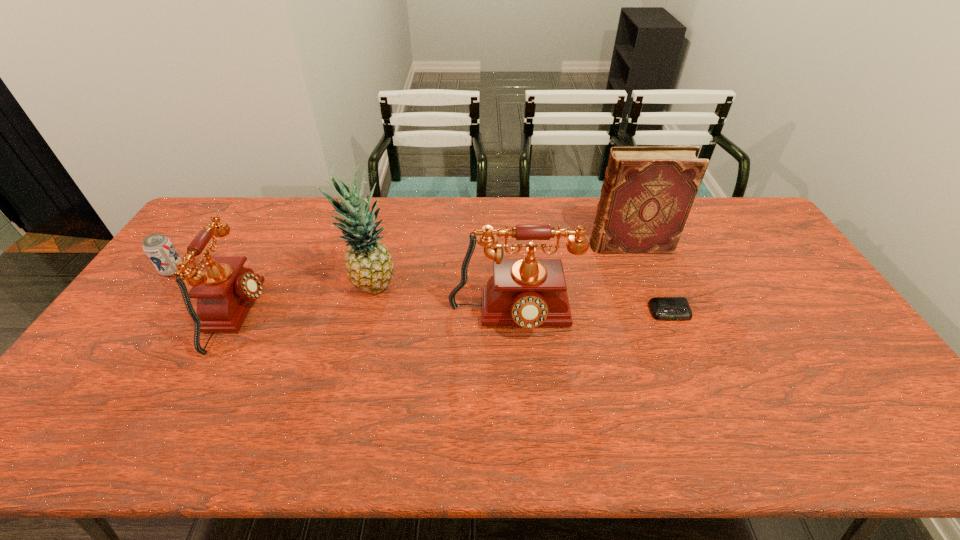
Please point a spot to add another telephone on the right. Please provide its 2D coordinates. Your answer should be formatted as a tuple, i.e. [(x, y)], where the tuple contains the x and y coordinates of a point satisfying the conditions above.

[(790, 321)]